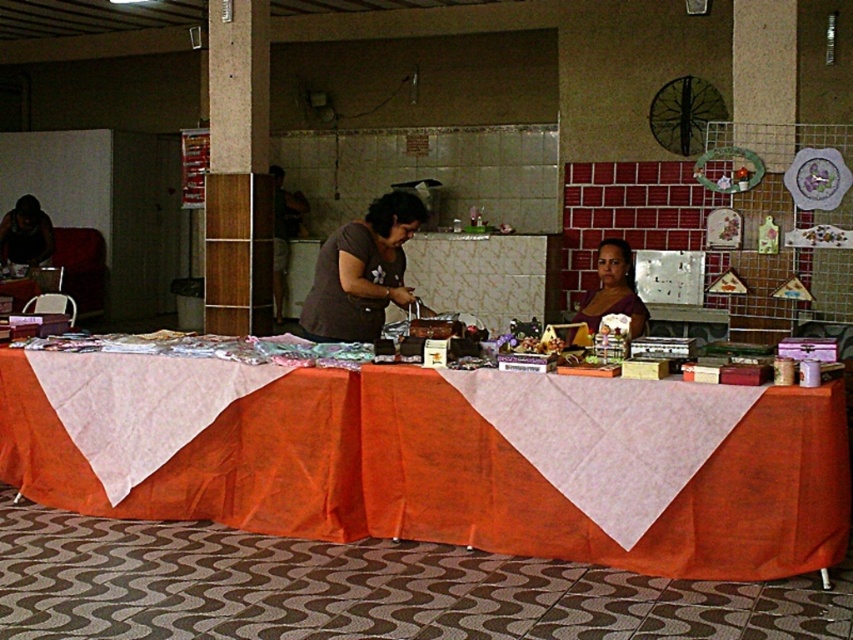
Is orange fabric table at center bigger than dark gray fabric at center?

Yes.

Identify the location of orange fabric table at center. This screenshot has width=853, height=640. (451, 476).

Which is in front, point (235, 518) or point (320, 248)?

Positioned in front is point (235, 518).

Locate an element on the screen. This screenshot has height=640, width=853. orange fabric table at center is located at coordinates (451, 476).

Is dark gray fabric at center below matte brown dress at center?

Incorrect, dark gray fabric at center is not positioned below matte brown dress at center.

Does dark gray fabric at center have a larger size compared to matte brown dress at center?

Yes.

Does point (345, 337) lie behind point (607, 291)?

No.

Locate an element on the screen. This screenshot has height=640, width=853. dark gray fabric at center is located at coordinates tap(363, 272).

Can you confirm if orange fabric table at center is shorter than matte brown dress at center?

No.

Which of these two, orange fabric table at center or matte brown dress at center, stands shorter?

matte brown dress at center is shorter.

Is point (303, 492) less distant than point (628, 300)?

Yes, point (303, 492) is in front of point (628, 300).

At what (x,y) coordinates should I click in order to perform the action: click on orange fabric table at center. Please return your answer as a coordinate pair (x, y). This screenshot has height=640, width=853. Looking at the image, I should click on (451, 476).